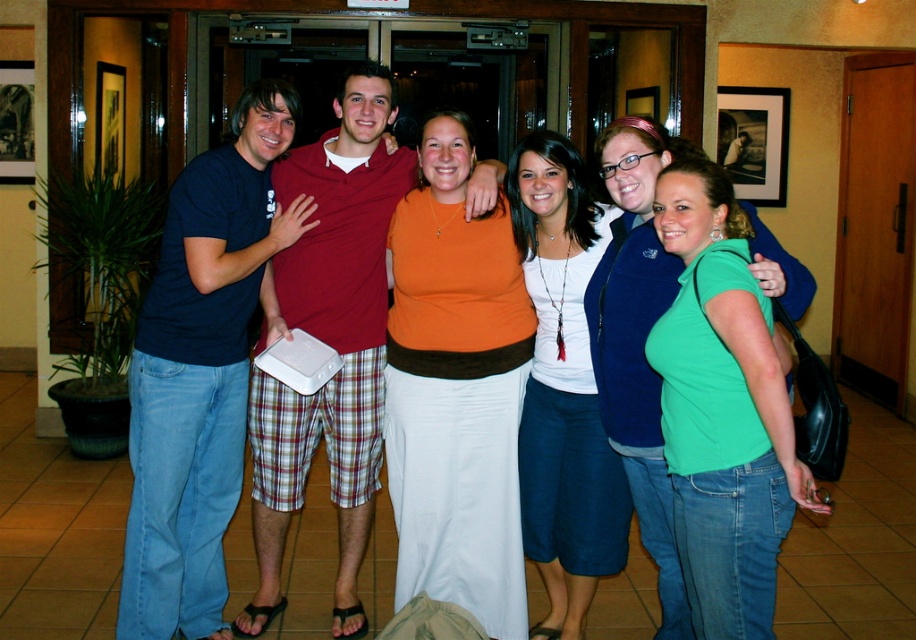
You are standing in the room where the group is posing. You need to place a small gift on the closest object to you between the matte blue jeans at left and the matte white box at center. Which object should you choose?

The matte blue jeans at left is closer to the viewer than the matte white box at center, so you should place the gift on the matte blue jeans at left.

You are organizing a photo shoot and need to ensure that all items in the scene are visible. The orange matte shirt at center and the matte white box at center are both important elements. Based on their sizes, which item might require more careful positioning to avoid being obscured by other objects?

The orange matte shirt at center has a smaller size compared to the matte white box at center, so it might require more careful positioning to avoid being obscured by other objects.

You are standing in the same room as the group of six people. You notice two points marked on the floor at coordinates point (161, 477) and point (438, 321). If you were to walk from your current position to the first point, then to the second point, would you be moving closer to or farther from the group as you go from the first to the second point?

Since point (161, 477) is in front of point (438, 321), moving from the first to the second point would take you farther from the group.